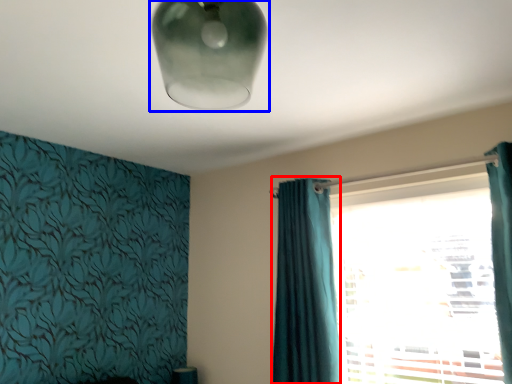
Question: Among these objects, which one is nearest to the camera, curtain (highlighted by a red box) or lamp (highlighted by a blue box)?

Choices:
 (A) curtain
 (B) lamp

Answer: (B)